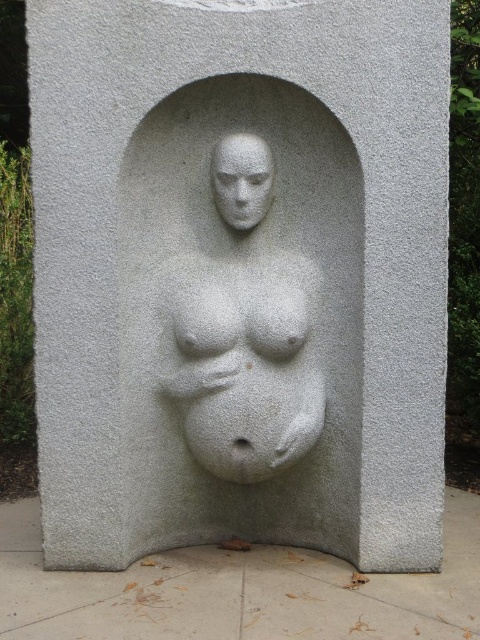
Is white textured stone pregnant figure at center above white stone face at center?

No.

Can you confirm if white textured stone pregnant figure at center is shorter than white stone face at center?

No.

Who is more distant from viewer, (319, 278) or (268, 154)?

Point (319, 278)

Identify the location of white textured stone pregnant figure at center. (242, 333).

Who is lower down, gray rough concrete at lower center or white textured stone pregnant figure at center?

gray rough concrete at lower center is lower down.

Is gray rough concrete at lower center in front of white textured stone pregnant figure at center?

Yes, gray rough concrete at lower center is closer to the viewer.

Between point (457, 605) and point (186, 380), which one is positioned in front?

Point (457, 605) is more forward.

This screenshot has height=640, width=480. In order to click on gray rough concrete at lower center in this screenshot , I will do `click(238, 592)`.

Can you confirm if gray rough concrete at lower center is wider than white stone face at center?

Correct, the width of gray rough concrete at lower center exceeds that of white stone face at center.

Which of these two, gray rough concrete at lower center or white stone face at center, stands shorter?

Standing shorter between the two is gray rough concrete at lower center.

At what (x,y) coordinates should I click in order to perform the action: click on gray rough concrete at lower center. Please return your answer as a coordinate pair (x, y). This screenshot has width=480, height=640. Looking at the image, I should click on (238, 592).